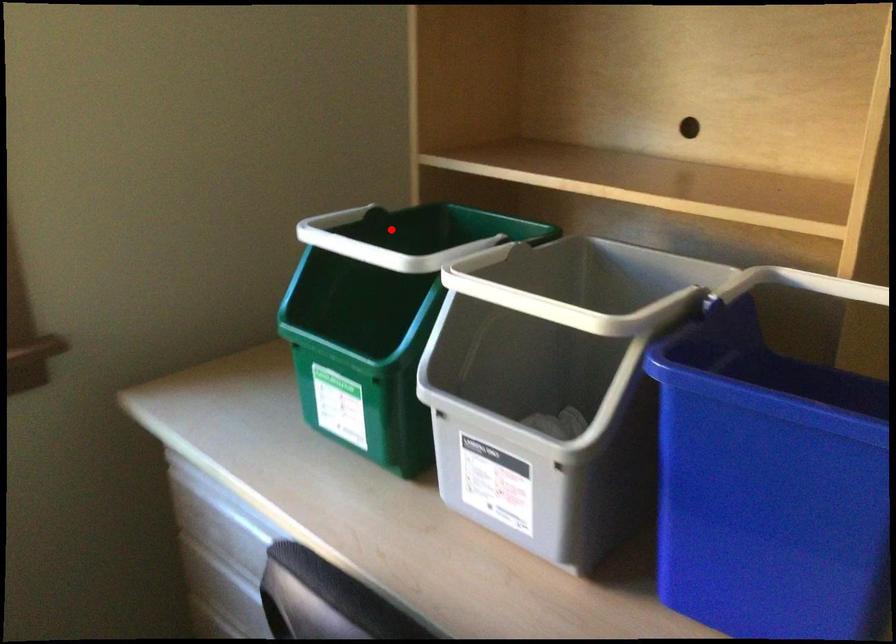
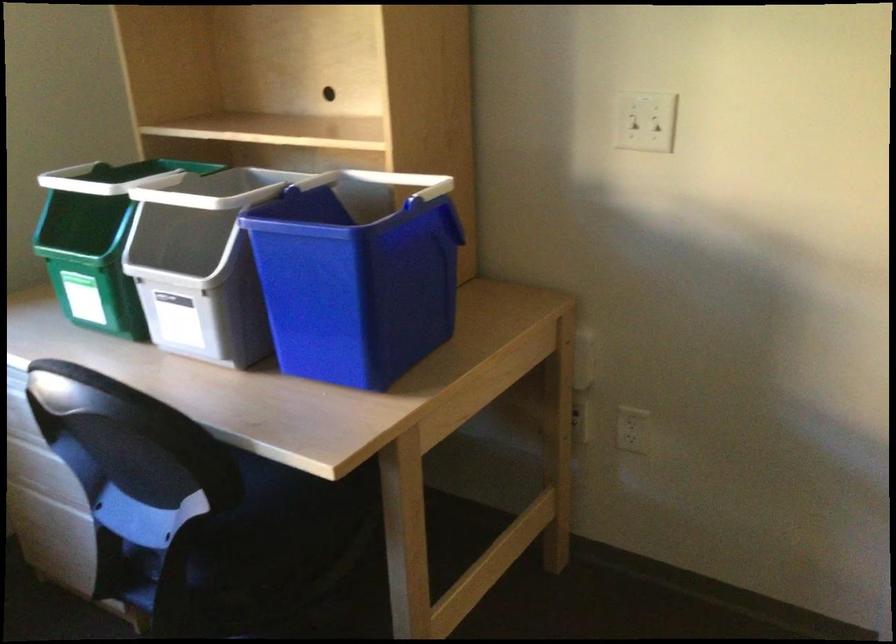
The point at the highlighted location is marked in the first image. Where is the corresponding point in the second image?

(116, 178)